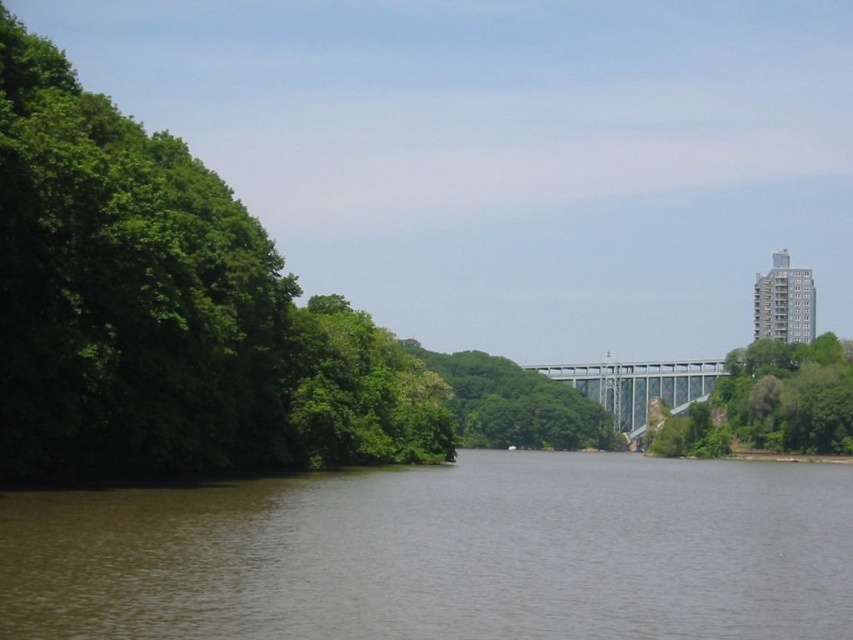
You are standing at the dense cluster of green trees on the left side of the riverside scene. You see two points marked on the steel bridge in the middle ground. Which point is closer to you, point (206,563) or point (186,400)?

Point (206,563) is in front of point (186,400), so it is closer to you.

You are a photographer standing on the riverside. You want to capture a photo that includes both the green leafy tree at right and the metallic gray bridge at center. Based on their positions, which object will appear closer to the camera in the photo?

The green leafy tree at right will appear closer to the camera in the photo because it is positioned in front of the metallic gray bridge at center.

In the scene shown: Based on the scene description, where is the green leafy tree at right located in terms of coordinates?

The green leafy tree at right is located at coordinates (770, 403).